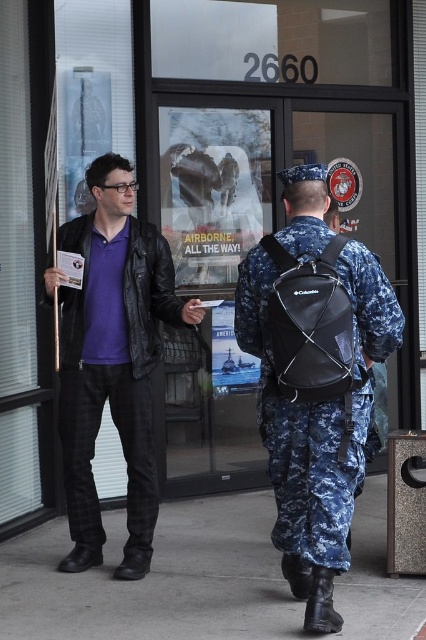
You are a delivery person trying to navigate between the matte black jacket at center and the navy blue camouflage uniform at right. The delivery cart you are using is 3 feet wide. Can you safely pass through the space between them without touching either?

The distance between the matte black jacket at center and the navy blue camouflage uniform at right is 35.76 inches, which converts to 2.98 feet. Since the delivery cart is 3 feet wide, it is slightly wider than the available space. Therefore, you cannot safely pass through the space between them without risking contact.

You are a delivery person trying to navigate to the address 2660. You see the gray concrete pavement at lower center and the navy blue camouflage uniform at right. Which direction should you walk to reach the building entrance?

The gray concrete pavement at lower center is to the left of the navy blue camouflage uniform at right, so you should walk towards the left from the navy blue camouflage uniform at right to reach the building entrance.